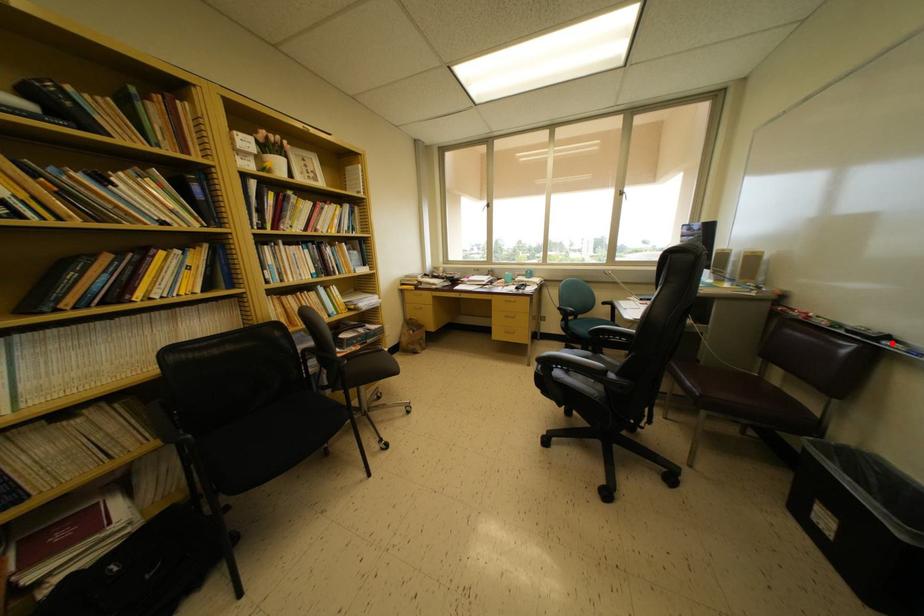
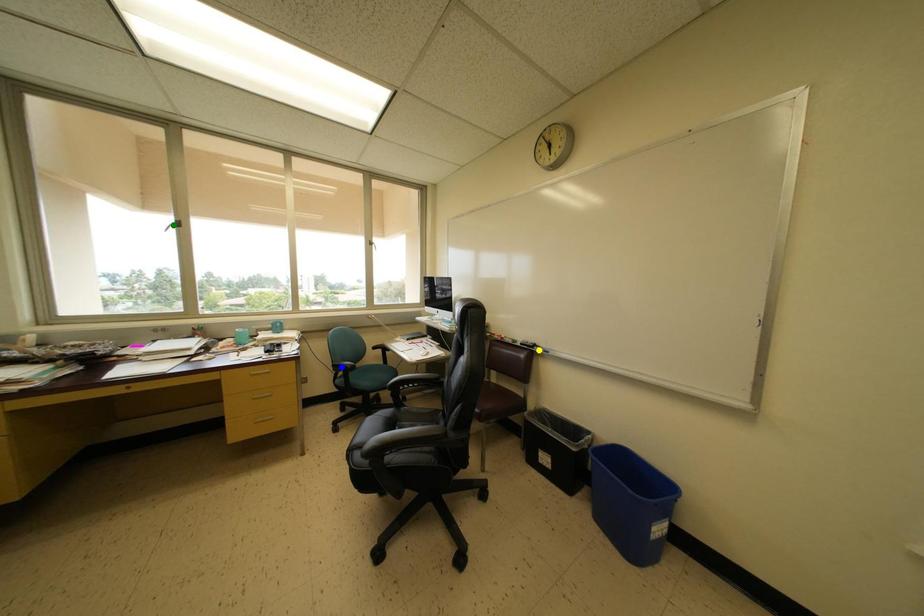
Question: I am providing you with two images of the same scene from different viewpoints. A red point is marked on the first image. You are given multiple points on the second image. Which point in image 2 represents the same 3d spot as the red point in image 1?

Choices:
 (A) yellow point
 (B) blue point
 (C) green point

Answer: (A)